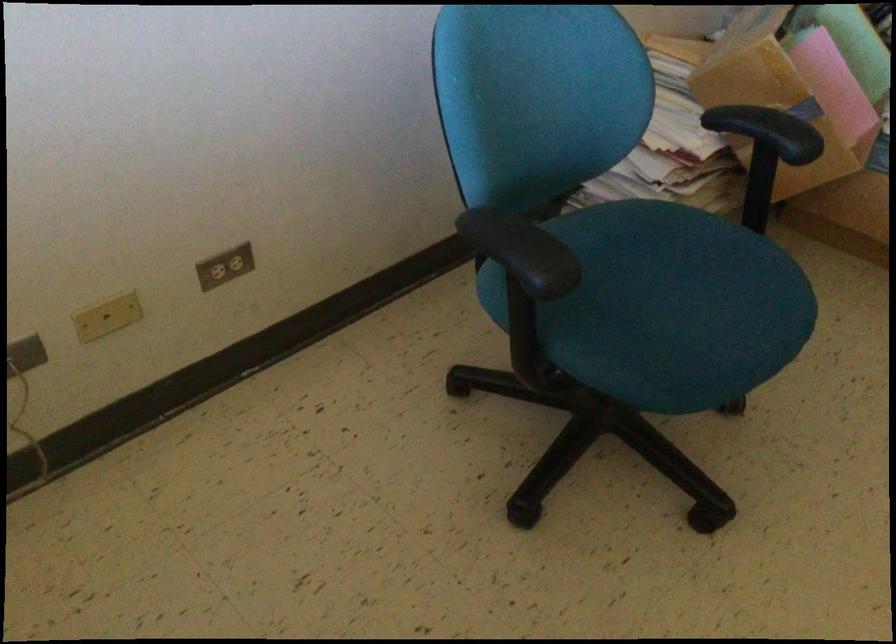
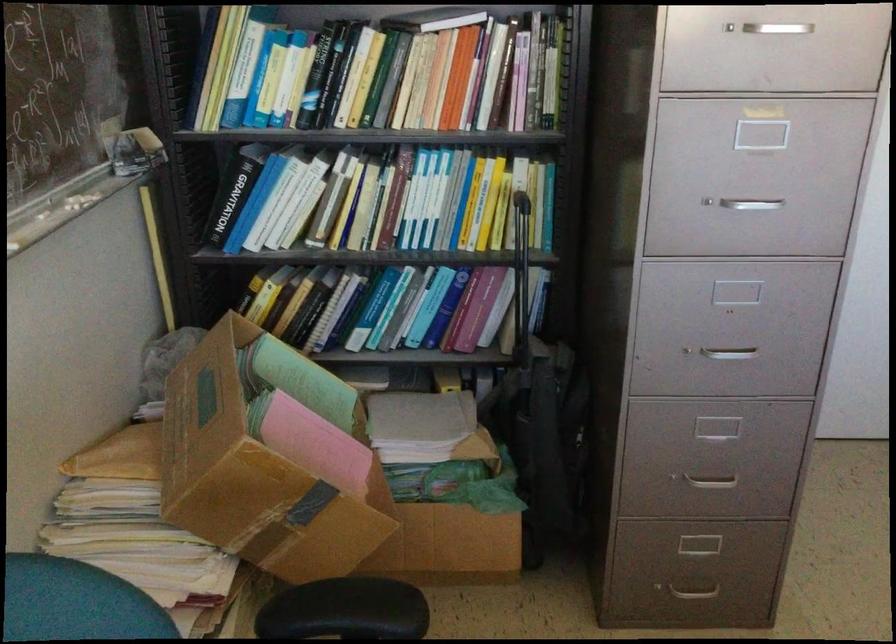
Question: The camera is either moving clockwise (left) or counter-clockwise (right) around the object. The first image is from the beginning of the video and the second image is from the end. Is the camera moving left or right when shooting the video?

Choices:
 (A) Left
 (B) Right

Answer: (A)